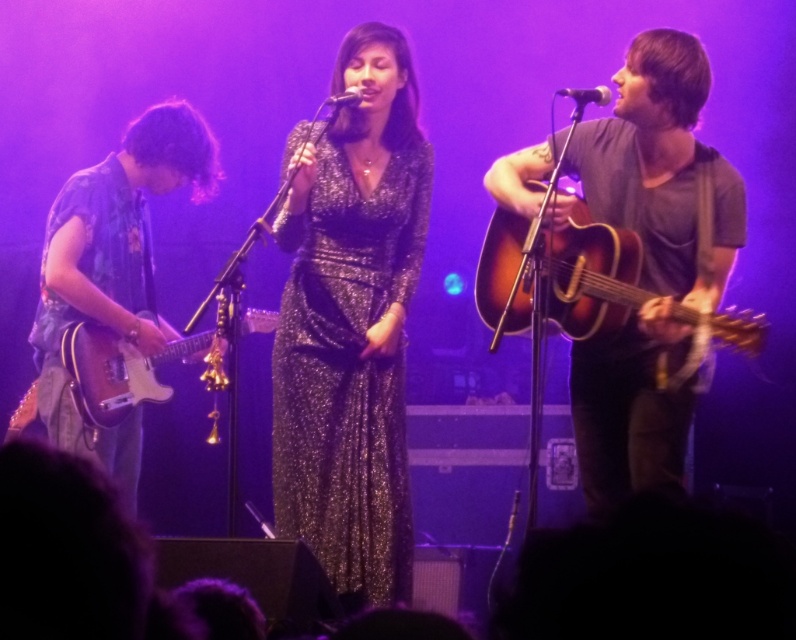
Question: Based on their relative distances, which object is nearer to the shiny black electric guitar at left?

Choices:
 (A) sparkly metallic dress at center
 (B) sunburst wood acoustic guitar at right

Answer: (A)

Question: Is matte brown acoustic guitar at right to the left of metallic silver microphone at upper right from the viewer's perspective?

Choices:
 (A) yes
 (B) no

Answer: (B)

Question: Is shiny black electric guitar at left smaller than metallic silver microphone at upper right?

Choices:
 (A) yes
 (B) no

Answer: (B)

Question: Which of the following is the farthest from the observer?

Choices:
 (A) sparkly metallic dress at center
 (B) sunburst wood acoustic guitar at right

Answer: (A)

Question: Based on their relative distances, which object is farther from the metallic silver microphone at upper right?

Choices:
 (A) matte brown acoustic guitar at right
 (B) blue floral shirt at left
 (C) metallic silver microphone at center
 (D) sparkly metallic dress at center

Answer: (B)

Question: Can you confirm if sparkly metallic dress at center is wider than blue floral shirt at left?

Choices:
 (A) yes
 (B) no

Answer: (B)